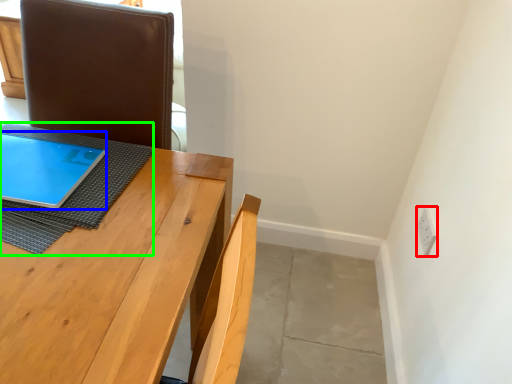
Question: Which object is the closest to the electric outlet (highlighted by a red box)? Choose among these: tablet computer (highlighted by a blue box) or cloth (highlighted by a green box).

Choices:
 (A) tablet computer
 (B) cloth

Answer: (B)